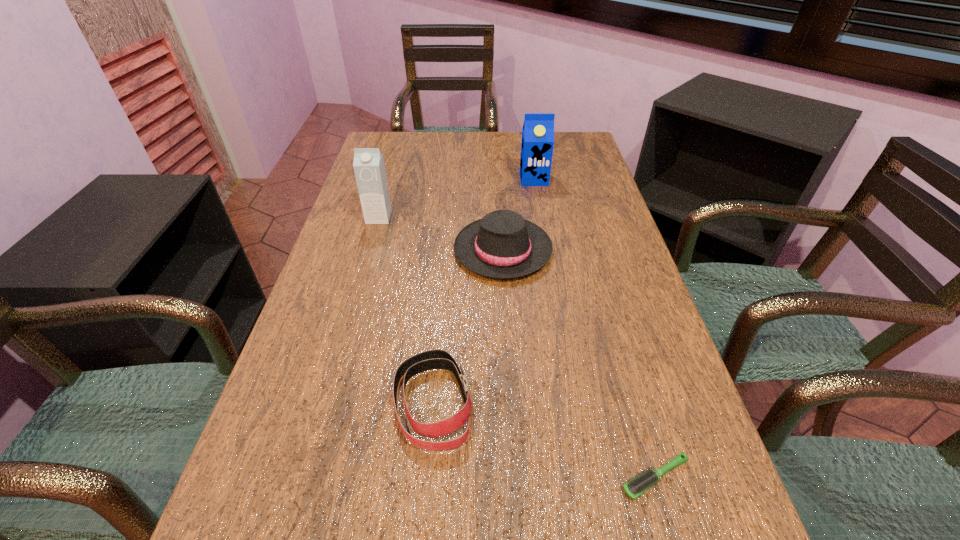
The width and height of the screenshot is (960, 540). I want to click on free space located on the front label of the leftmost object, so click(x=353, y=308).

What are the coordinates of `vacant space located on the back of the third shortest object` in the screenshot? It's located at (497, 163).

Image resolution: width=960 pixels, height=540 pixels. I want to click on free space located 0.230m on the back of the second nearest object, so click(x=444, y=279).

The image size is (960, 540). I want to click on free space located 0.350m on the left of the hairbrush, so click(x=400, y=477).

Where is `object that is at the left edge`? This screenshot has width=960, height=540. object that is at the left edge is located at coordinates (369, 167).

You are a GUI agent. You are given a task and a screenshot of the screen. Output one action in this format:
    pyautogui.click(x=<x>, y=<y>)
    Task: Click on the object at the right edge
    This screenshot has height=540, width=960.
    Given the screenshot: What is the action you would take?
    pyautogui.click(x=635, y=487)

Find the location of `blank space at the far edge of the desktop`. blank space at the far edge of the desktop is located at coordinates (437, 140).

In the image, there is a desktop. Where is `vacant space at the left edge`? This screenshot has width=960, height=540. vacant space at the left edge is located at coordinates (328, 457).

In the image, there is a desktop. Where is `free space at the right edge`? free space at the right edge is located at coordinates (579, 284).

The image size is (960, 540). I want to click on free space at the far right corner of the desktop, so click(x=581, y=146).